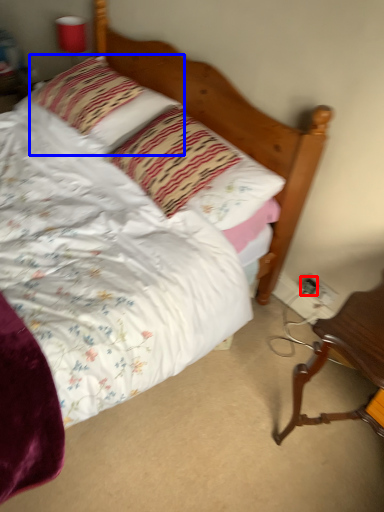
Question: Among these objects, which one is nearest to the camera, electric outlet (highlighted by a red box) or pillow (highlighted by a blue box)?

Choices:
 (A) electric outlet
 (B) pillow

Answer: (B)